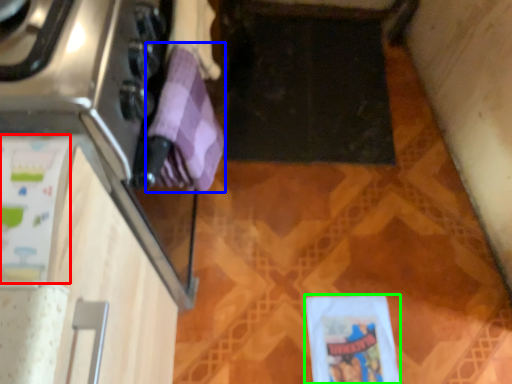
Question: Estimate the real-world distances between objects in this image. Which object is closer to wrapping paper (highlighted by a red box), wrapping paper (highlighted by a blue box) or wrapping paper (highlighted by a green box)?

Choices:
 (A) wrapping paper
 (B) wrapping paper

Answer: (A)